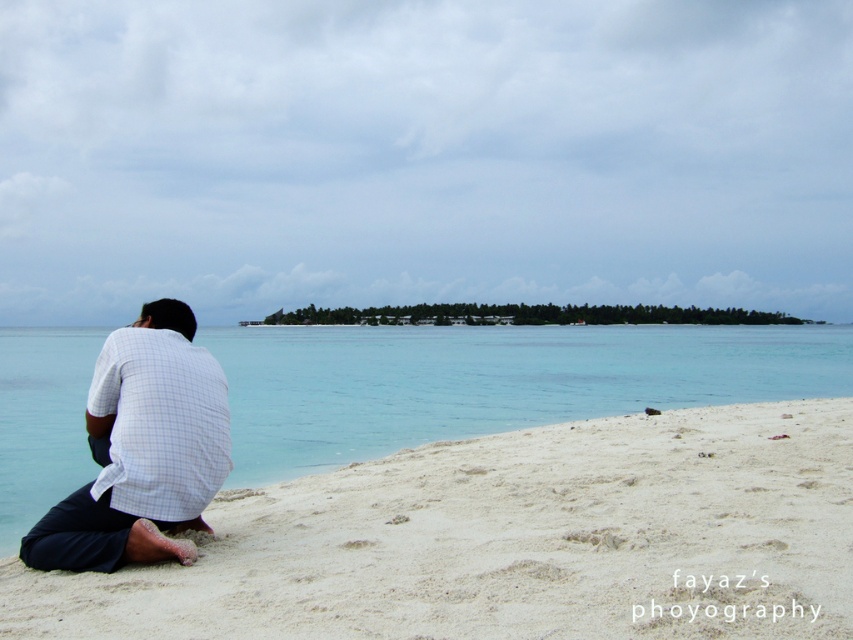
Consider the image. You are standing on the beach and see the white sandy beach at lower left and the white checkered shirt at lower left. Which object is nearer to you?

The white sandy beach at lower left is closer to the viewer than the white checkered shirt at lower left, so the white sandy beach at lower left is nearer.

You are standing at the point labeled as point (509,540) in the image. Looking towards the ocean, which direction should you walk to reach the white sandy beach at lower left?

You are already standing on the white sandy beach at lower left since the point (509,540) corresponds to it.